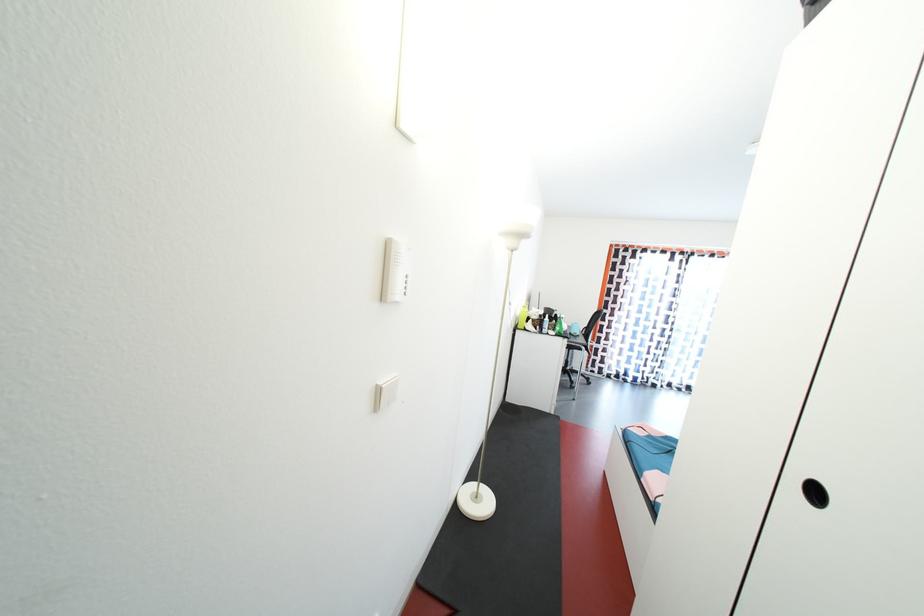
What are the coordinates of `recessed cabinet handle` in the screenshot? It's located at (815, 493).